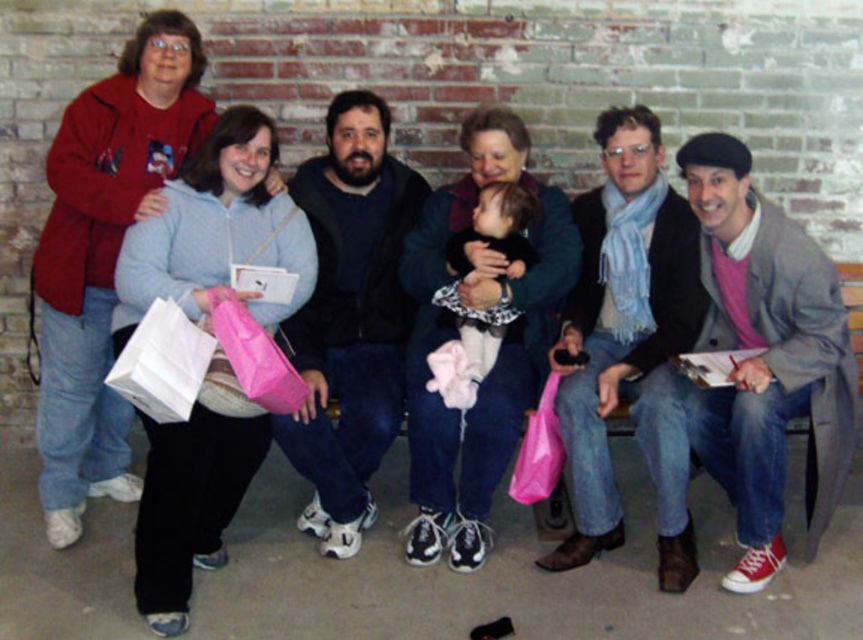
What do you see at coordinates (628, 344) in the screenshot?
I see `blue scarf at center` at bounding box center [628, 344].

Is point (657, 477) closer to viewer compared to point (483, 496)?

That is True.

This screenshot has height=640, width=863. I want to click on blue scarf at center, so click(628, 344).

Looking at this image, does pink wool sweater at right have a greater height compared to dark blue fleece at center?

No.

Is pink wool sweater at right positioned behind dark blue fleece at center?

That is False.

Between point (747, 470) and point (300, 355), which one is positioned behind?

Positioned behind is point (300, 355).

Locate an element on the screen. Image resolution: width=863 pixels, height=640 pixels. pink wool sweater at right is located at coordinates (765, 356).

Consider the image. Which is more to the right, blue scarf at center or light blue fleece sweater at upper left?

blue scarf at center

Who is positioned more to the left, blue scarf at center or light blue fleece sweater at upper left?

Positioned to the left is light blue fleece sweater at upper left.

Which is behind, point (633, 374) or point (186, 188)?

Positioned behind is point (633, 374).

Locate an element on the screen. This screenshot has height=640, width=863. blue scarf at center is located at coordinates (628, 344).